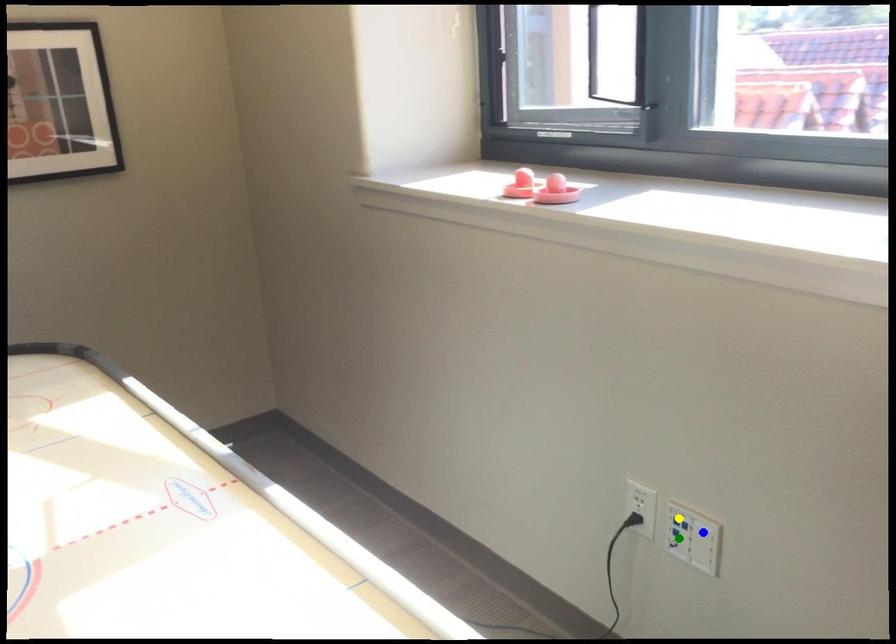
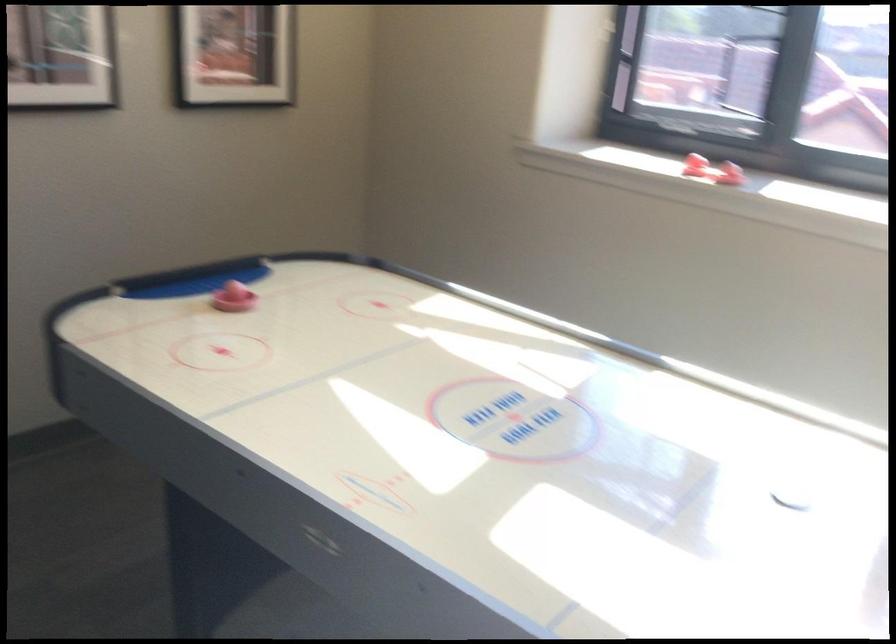
I am providing you with two images of the same scene from different viewpoints. Three points are marked in image1. Which point corresponds to a part or object that is occluded in image2?In image1, three points are marked. Which of them correspond to a part or object that is occluded in image2?Among the three points shown in image1, which one corresponds to a part or object that is no longer visible due to occlusion in image2?

green point, blue point, yellow point